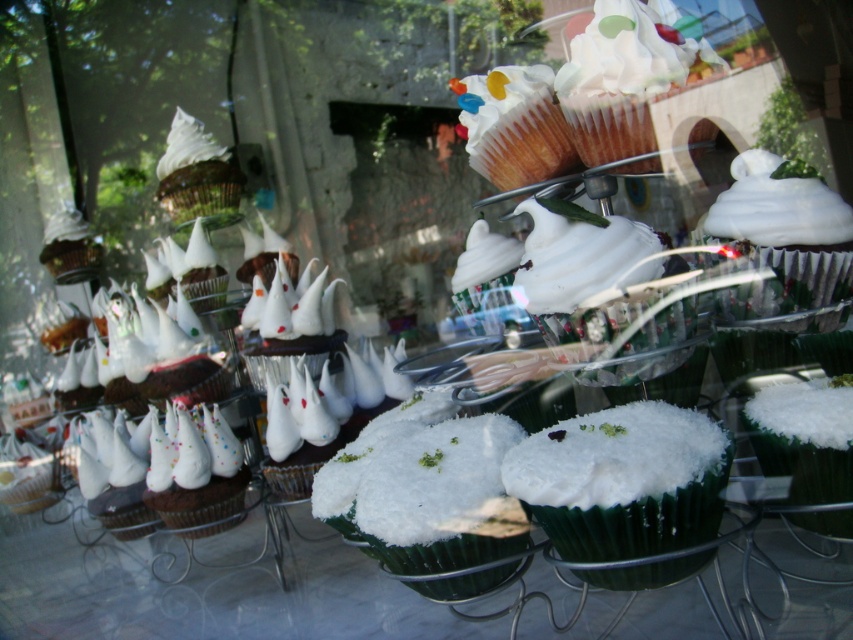
Which is above, white glossy frosting at center or white glossy frosting at upper left?

white glossy frosting at upper left is above.

This screenshot has height=640, width=853. What do you see at coordinates (579, 257) in the screenshot?
I see `white glossy frosting at center` at bounding box center [579, 257].

Is point (550, 301) positioned behind point (196, 157)?

No.

Where is `white glossy frosting at center`? The width and height of the screenshot is (853, 640). white glossy frosting at center is located at coordinates (579, 257).

Can you confirm if white fluffy frosting at center is positioned below white glossy frosting at upper left?

Correct, white fluffy frosting at center is located below white glossy frosting at upper left.

Between white fluffy frosting at center and white glossy frosting at upper left, which one has more height?

Standing taller between the two is white glossy frosting at upper left.

Locate an element on the screen. white fluffy frosting at center is located at coordinates (614, 456).

At what (x,y) coordinates should I click in order to perform the action: click on white fluffy frosting at center. Please return your answer as a coordinate pair (x, y). Looking at the image, I should click on (614, 456).

Who is more forward, (514, 456) or (776, 452)?

Positioned in front is point (514, 456).

Who is positioned more to the right, white fluffy frosting at center or white fluffy cupcake at center?

Positioned to the right is white fluffy cupcake at center.

Which is behind, point (637, 428) or point (766, 467)?

Positioned behind is point (766, 467).

The width and height of the screenshot is (853, 640). Find the location of `white fluffy frosting at center`. white fluffy frosting at center is located at coordinates (614, 456).